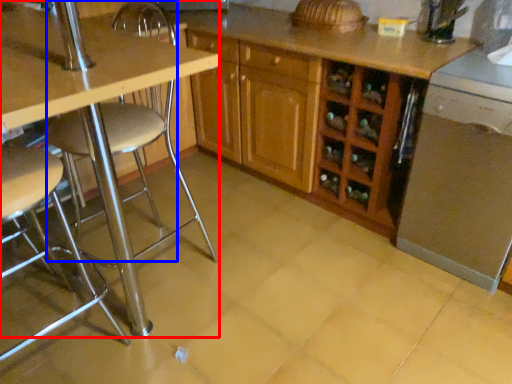
Question: Among these objects, which one is nearest to the camera, table (highlighted by a red box) or swivel chair (highlighted by a blue box)?

Choices:
 (A) table
 (B) swivel chair

Answer: (B)